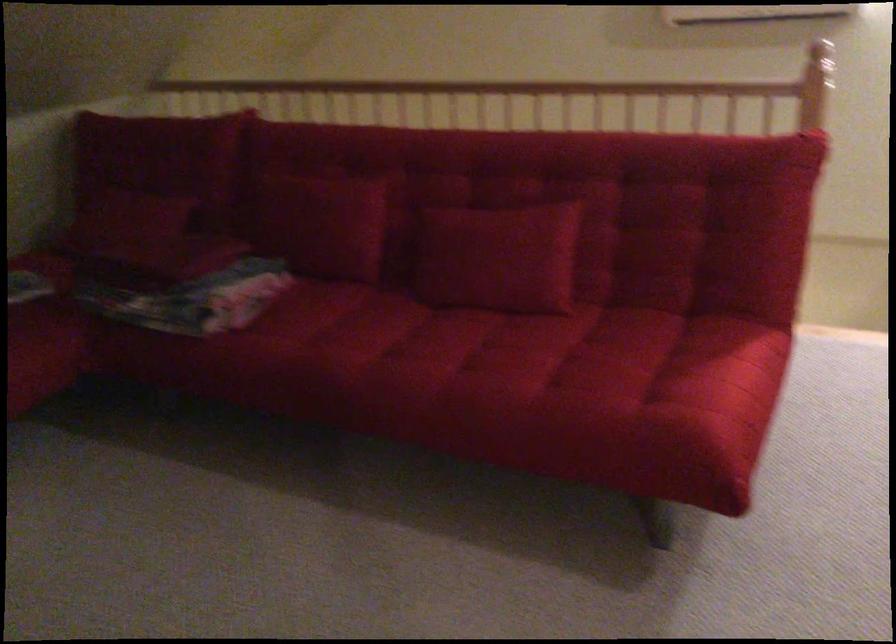
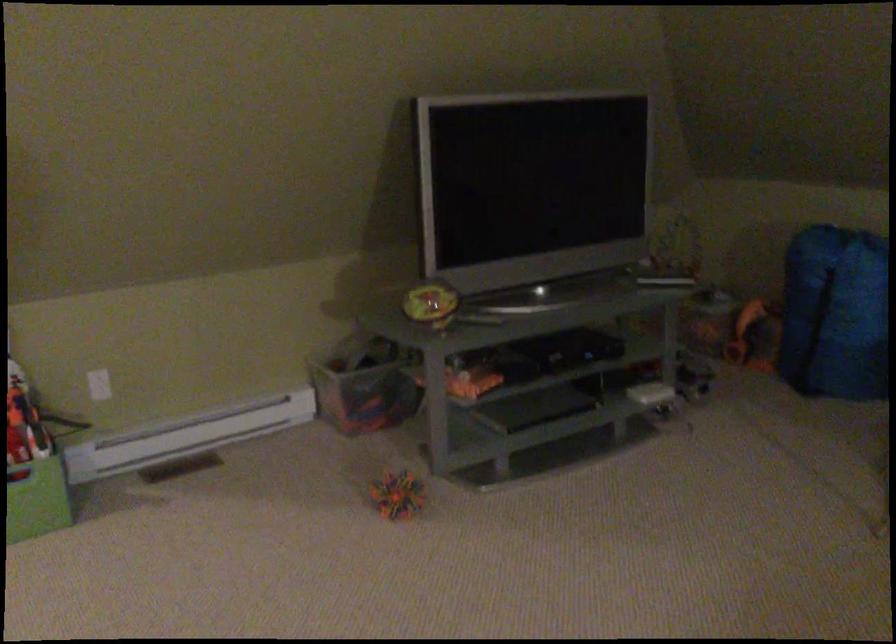
From the picture: How did the camera likely rotate?

The camera's rotation is toward left-down.